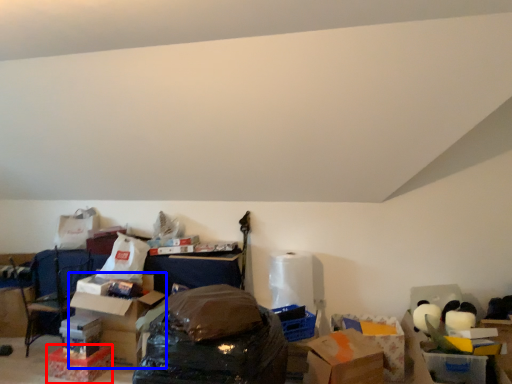
Question: Which of the following is the farthest to the observer, storage box (highlighted by a red box) or cardboard box (highlighted by a blue box)?

Choices:
 (A) storage box
 (B) cardboard box

Answer: (B)